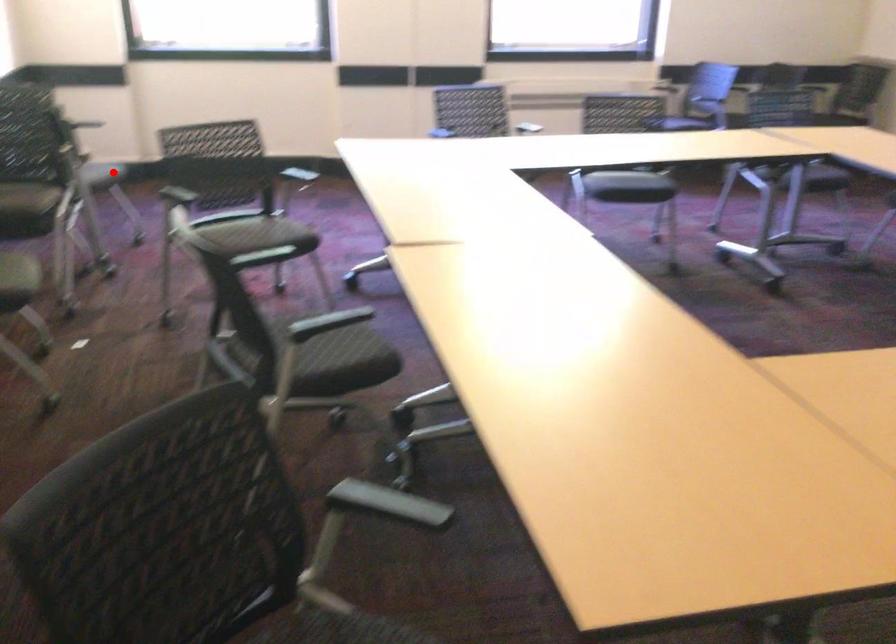
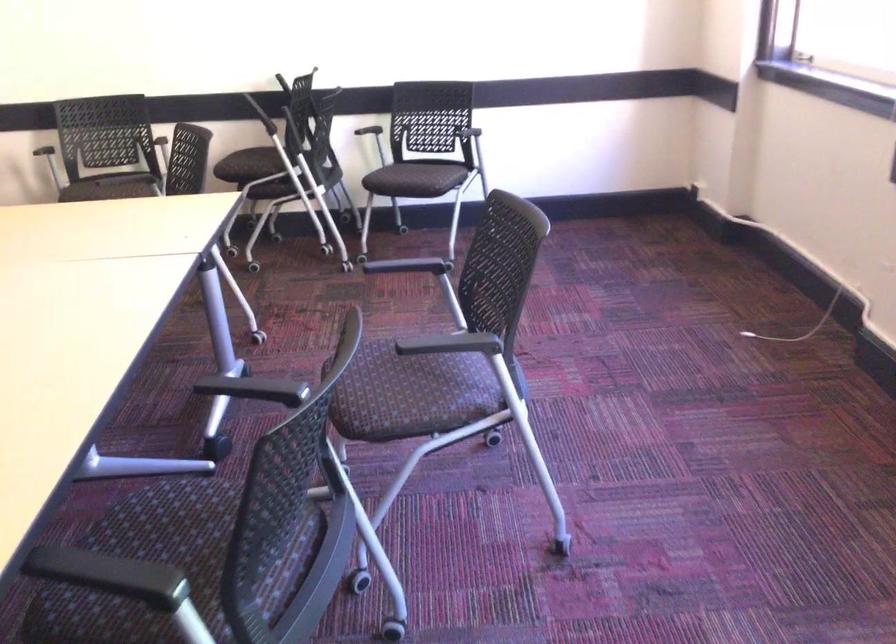
The point at the highlighted location is marked in the first image. Where is the corresponding point in the second image?

(415, 178)